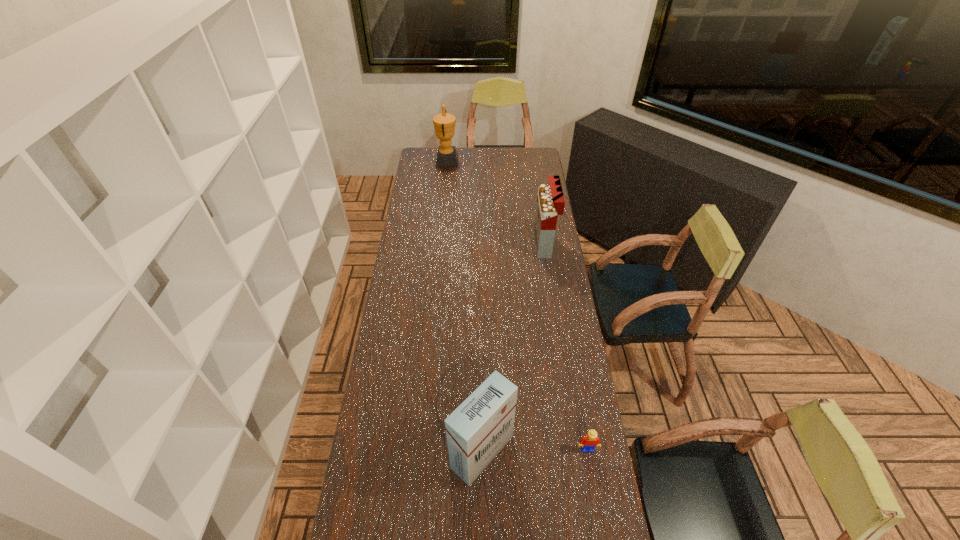
This screenshot has width=960, height=540. I want to click on vacant space that satisfies the following two spatial constraints: 1. at the front of the farthest object with handles; 2. on the back side of the second object from left to right, so click(419, 452).

The width and height of the screenshot is (960, 540). Find the location of `vacant space that satisfies the following two spatial constraints: 1. at the front of the third object from right to left with handles; 2. on the right side of the leftmost object`. vacant space that satisfies the following two spatial constraints: 1. at the front of the third object from right to left with handles; 2. on the right side of the leftmost object is located at coordinates (419, 452).